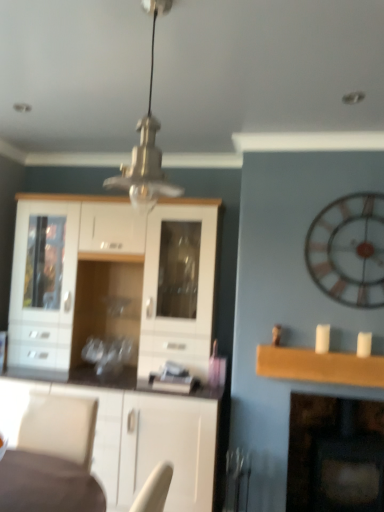
Question: Should I look upward or downward to see white glossy cabinet at center?

Choices:
 (A) up
 (B) down

Answer: (B)

Question: Is the position of white glossy cabinet at center more distant than that of dark brown wood fireplace at lower right?

Choices:
 (A) yes
 (B) no

Answer: (B)

Question: Does white glossy cabinet at center have a lesser height compared to dark brown wood fireplace at lower right?

Choices:
 (A) no
 (B) yes

Answer: (A)

Question: Is white glossy cabinet at center outside of dark brown wood fireplace at lower right?

Choices:
 (A) no
 (B) yes

Answer: (B)

Question: Are white glossy cabinet at center and dark brown wood fireplace at lower right far apart?

Choices:
 (A) yes
 (B) no

Answer: (A)

Question: Is white glossy cabinet at center smaller than dark brown wood fireplace at lower right?

Choices:
 (A) yes
 (B) no

Answer: (B)

Question: Does white glossy cabinet at center appear on the left side of dark brown wood fireplace at lower right?

Choices:
 (A) yes
 (B) no

Answer: (A)

Question: From the image's perspective, does wooden clock at right appear lower than metallic glass pendant light at center?

Choices:
 (A) yes
 (B) no

Answer: (A)

Question: Does wooden clock at right appear on the left side of metallic glass pendant light at center?

Choices:
 (A) yes
 (B) no

Answer: (B)

Question: Does wooden clock at right lie behind metallic glass pendant light at center?

Choices:
 (A) yes
 (B) no

Answer: (A)

Question: From a real-world perspective, is wooden clock at right beneath metallic glass pendant light at center?

Choices:
 (A) no
 (B) yes

Answer: (B)

Question: Is wooden clock at right aimed at metallic glass pendant light at center?

Choices:
 (A) no
 (B) yes

Answer: (A)

Question: Is wooden clock at right bigger than metallic glass pendant light at center?

Choices:
 (A) no
 (B) yes

Answer: (A)

Question: From a real-world perspective, is wooden clock at right positioned over dark brown wood fireplace at lower right based on gravity?

Choices:
 (A) yes
 (B) no

Answer: (A)